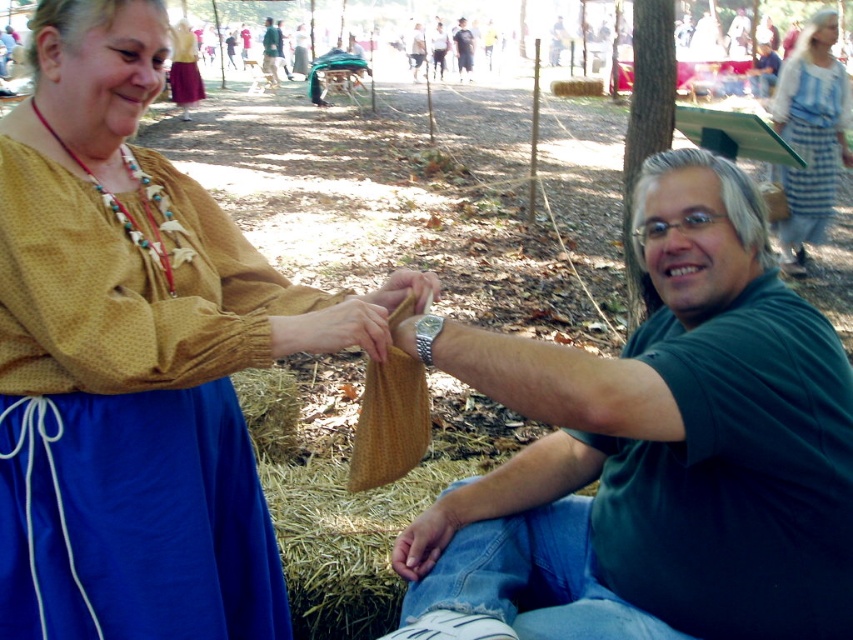
You are standing at the origin point in the image. Which of the two points, point [184,99] or point [467,44], is closer to you?

Point [184,99] is closer to you since it is in front of point [467,44].

In the scene described, there are two people wearing different outfits. The first person is wearing a blue striped dress at upper right, and the second is wearing dark blue jeans at center. From the perspective of an observer looking at the image, which outfit is located lower in the frame?

The blue striped dress at upper right is positioned under dark blue jeans at center, meaning the blue striped dress at upper right is actually lower in the frame than the dark blue jeans at center.